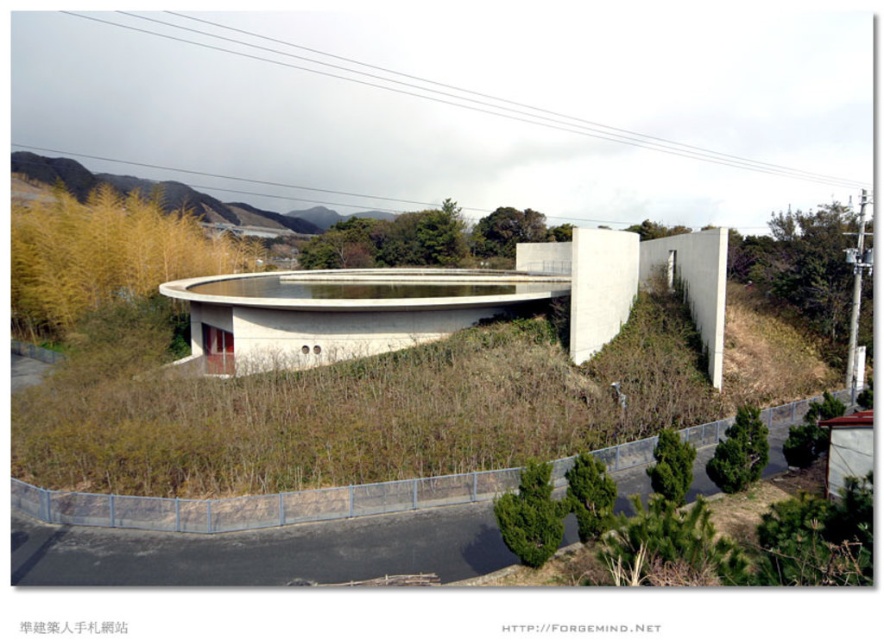
Question: Which of the following is the closest to the observer?

Choices:
 (A) smooth concrete overpass at center
 (B) green matte grass at center
 (C) yellow grass at upper left

Answer: (B)

Question: Which object is closer to the camera taking this photo?

Choices:
 (A) smooth concrete overpass at center
 (B) green matte grass at center
 (C) yellow grass at upper left

Answer: (B)

Question: Among these objects, which one is nearest to the camera?

Choices:
 (A) green matte grass at center
 (B) yellow grass at upper left

Answer: (A)

Question: Does green matte grass at center come in front of yellow grass at upper left?

Choices:
 (A) yes
 (B) no

Answer: (A)

Question: Can you confirm if smooth concrete overpass at center is positioned below yellow grass at upper left?

Choices:
 (A) no
 (B) yes

Answer: (B)

Question: Does smooth concrete overpass at center appear on the left side of yellow grass at upper left?

Choices:
 (A) yes
 (B) no

Answer: (B)